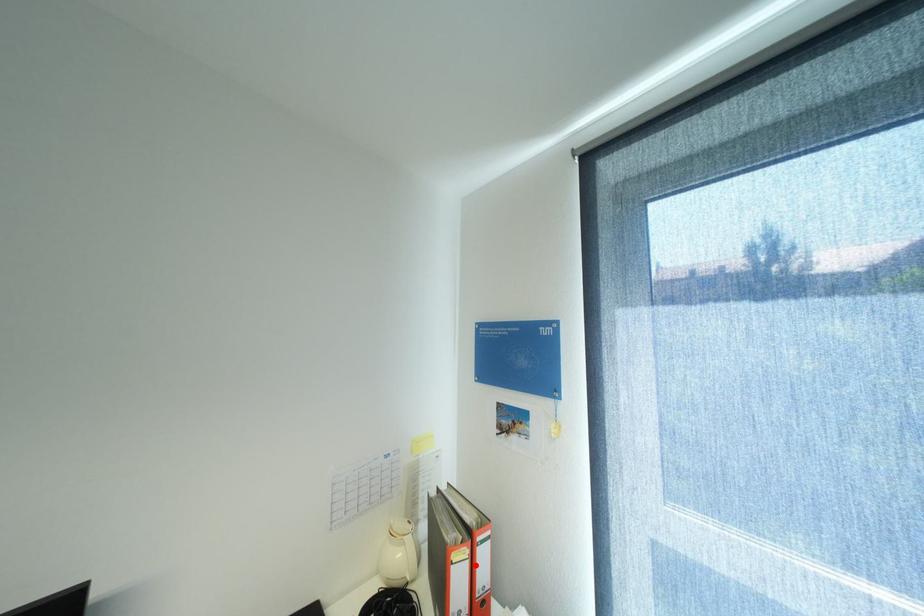
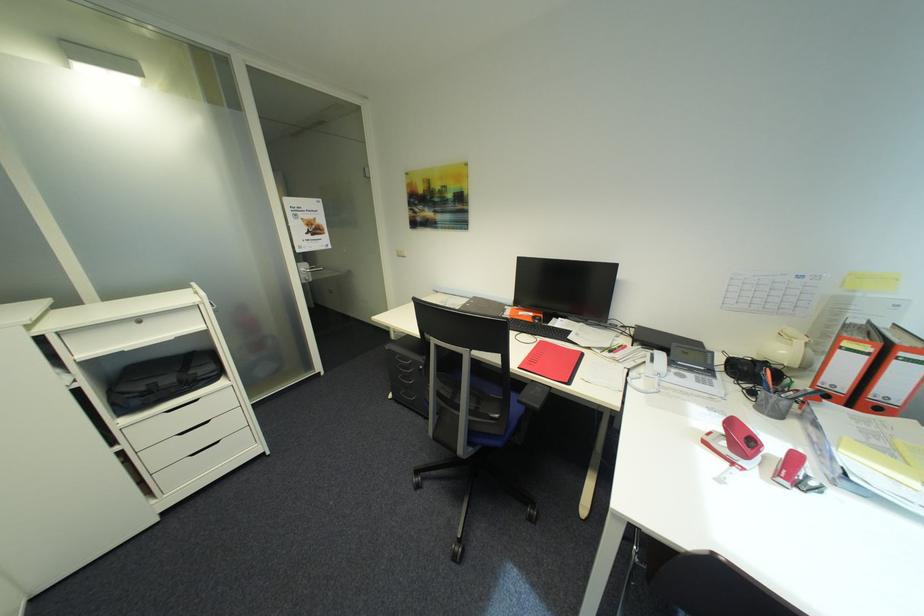
The point at the highlighted location is marked in the first image. Where is the corresponding point in the second image?

(872, 359)